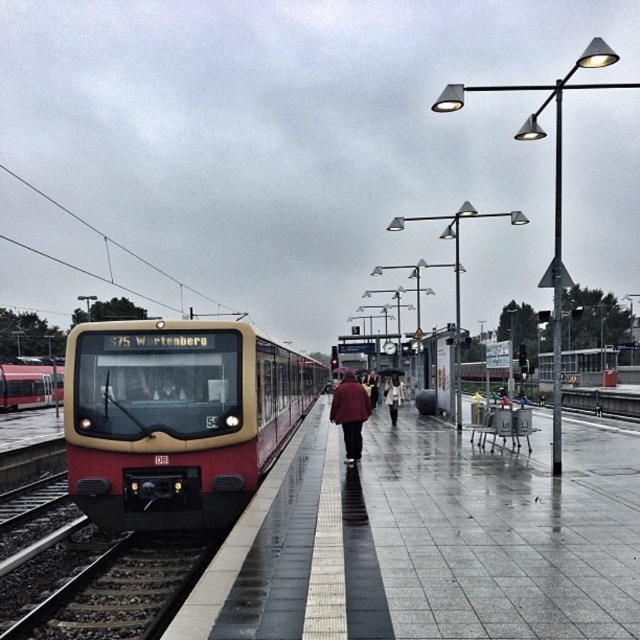
Question: Which is farther from the smooth concrete platform at center?

Choices:
 (A) matte black jacket at center
 (B) red matte train at left
 (C) matte red train at center

Answer: (B)

Question: Which of the following is the closest to the observer?

Choices:
 (A) (36, 406)
 (B) (397, 401)
 (C) (173, 385)

Answer: (C)

Question: Considering the relative positions of red wool coat at center and matte black jacket at center in the image provided, where is red wool coat at center located with respect to matte black jacket at center?

Choices:
 (A) above
 (B) below

Answer: (B)

Question: Does smooth concrete platform at center appear under matte red train at center?

Choices:
 (A) yes
 (B) no

Answer: (B)

Question: Can you confirm if smooth concrete platform at center is bigger than matte black jacket at center?

Choices:
 (A) yes
 (B) no

Answer: (A)

Question: Which point is closer to the camera?

Choices:
 (A) smooth concrete platform at center
 (B) light beige coat at center
 (C) matte black jacket at center

Answer: (A)